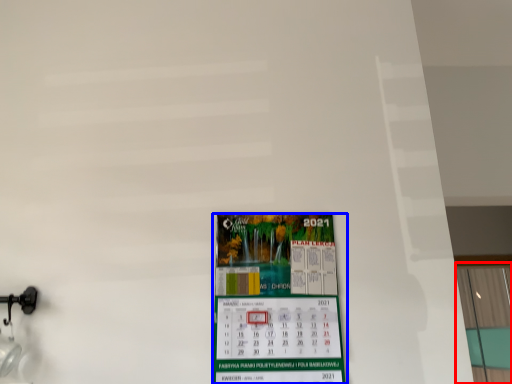
Question: Which point is further to the camera, window (highlighted by a red box) or poster (highlighted by a blue box)?

Choices:
 (A) window
 (B) poster

Answer: (A)